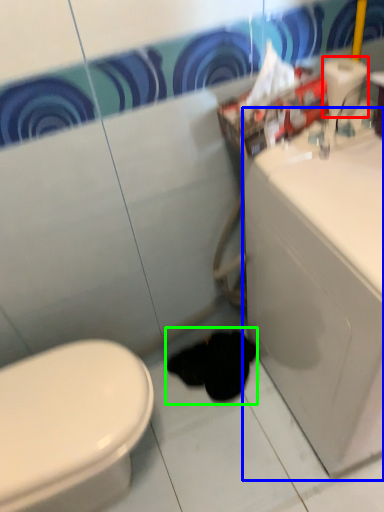
Question: Considering the real-world distances, which object is farthest from toilet paper (highlighted by a red box)? porcelain (highlighted by a blue box) or animal (highlighted by a green box)?

Choices:
 (A) porcelain
 (B) animal

Answer: (B)